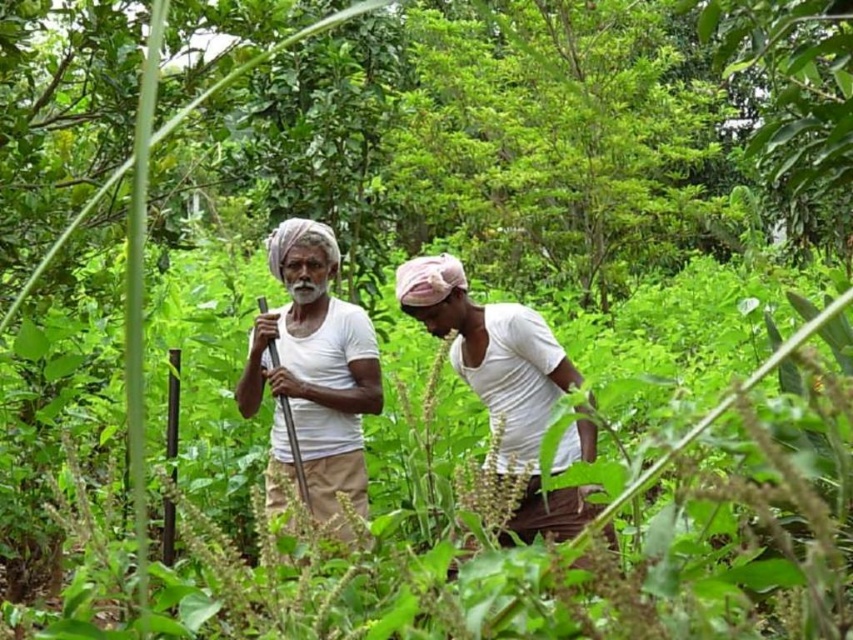
Question: Which object is farther from the camera taking this photo?

Choices:
 (A) white cotton turban at center
 (B) white cotton shirt at center

Answer: (A)

Question: Which of the following is the closest to the observer?

Choices:
 (A) green leafy tree at center
 (B) white cotton shirt at center

Answer: (B)

Question: Which of the following is the farthest from the observer?

Choices:
 (A) green leafy tree at center
 (B) white cotton shirt at center

Answer: (A)

Question: Does green leafy tree at center appear under white cotton turban at center?

Choices:
 (A) yes
 (B) no

Answer: (B)

Question: Is the position of green leafy tree at center less distant than that of white cotton shirt at center?

Choices:
 (A) no
 (B) yes

Answer: (A)

Question: Is green leafy tree at center further to the viewer compared to white cotton turban at center?

Choices:
 (A) no
 (B) yes

Answer: (B)